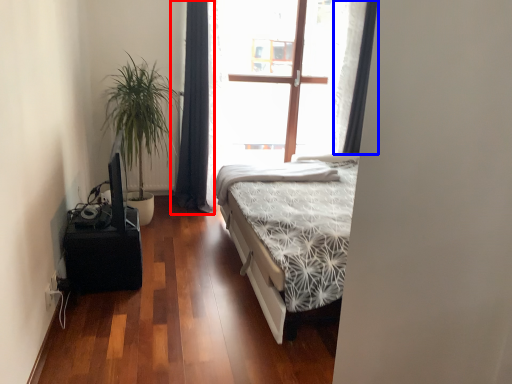
Question: Among these objects, which one is nearest to the camera, curtain (highlighted by a red box) or curtain (highlighted by a blue box)?

Choices:
 (A) curtain
 (B) curtain

Answer: (A)